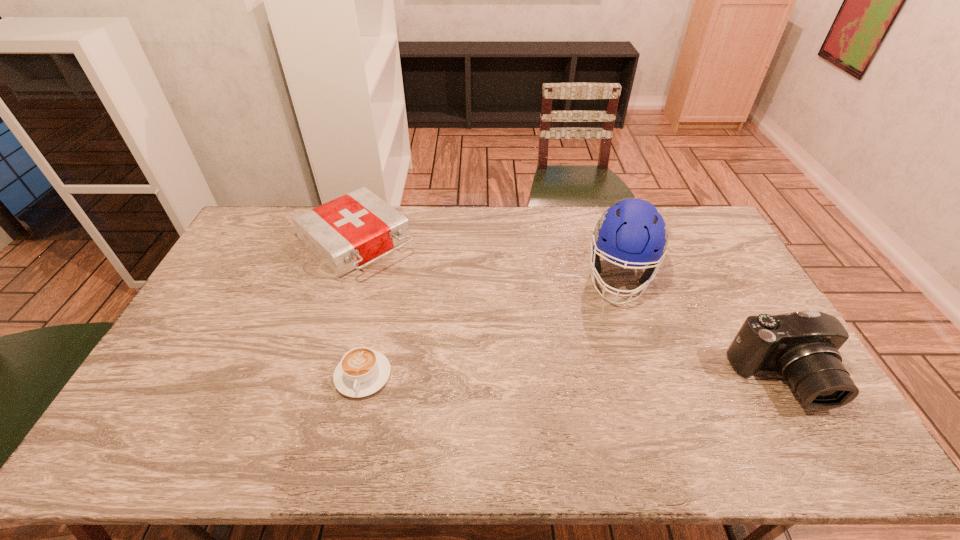
Locate an element on the screen. The image size is (960, 540). free space on the desktop that is between the shortest object and the third shortest object and is positioned on the face guard of the second object from right to left is located at coordinates (602, 378).

Locate an element on the screen. The height and width of the screenshot is (540, 960). free space on the desktop that is between the cappuccino and the camera and is positioned on the front side of the second shortest object is located at coordinates (514, 377).